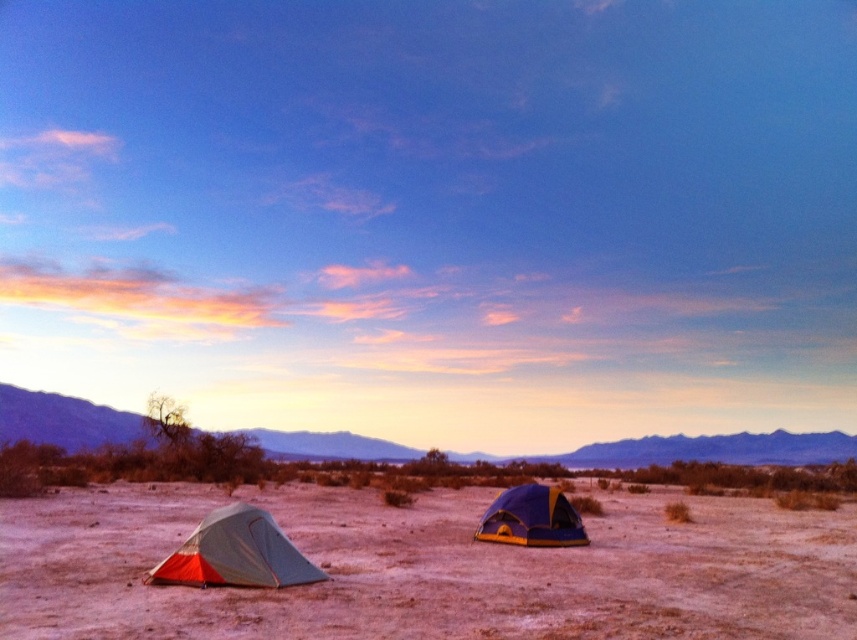
Question: Which object is the closest to the blue/yellow fabric tent at center?

Choices:
 (A) gray sand at center
 (B) orange fabric tent at lower left

Answer: (B)

Question: Among these points, which one is farthest from the camera?

Choices:
 (A) (33, 595)
 (B) (255, 538)

Answer: (B)

Question: Among these points, which one is farthest from the camera?

Choices:
 (A) (517, 497)
 (B) (788, 548)
 (C) (249, 525)

Answer: (B)

Question: Is orange fabric tent at lower left further to camera compared to blue/yellow fabric tent at center?

Choices:
 (A) no
 (B) yes

Answer: (A)

Question: Is gray sand at center closer to camera compared to blue/yellow fabric tent at center?

Choices:
 (A) no
 (B) yes

Answer: (B)

Question: Observing the image, what is the correct spatial positioning of gray sand at center in reference to blue/yellow fabric tent at center?

Choices:
 (A) right
 (B) left

Answer: (B)